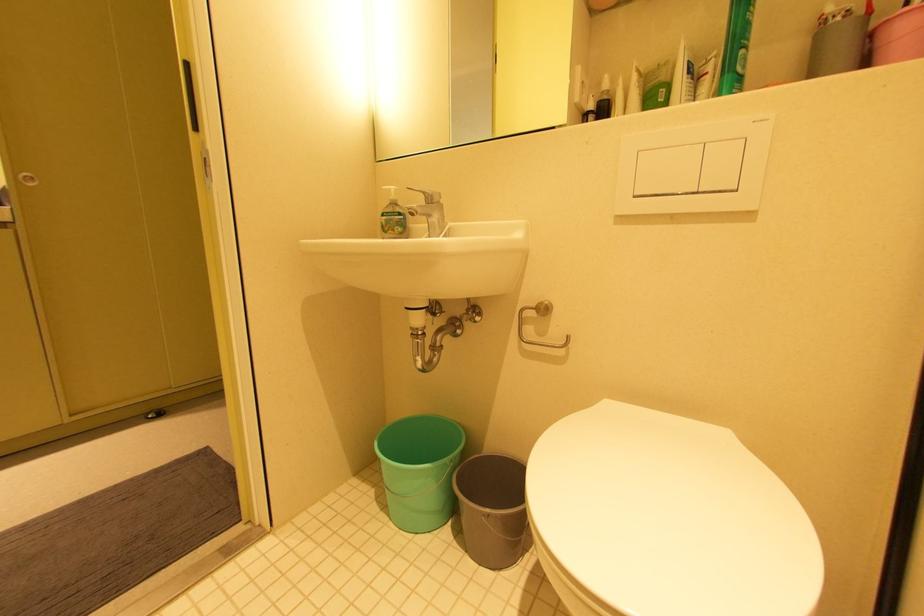
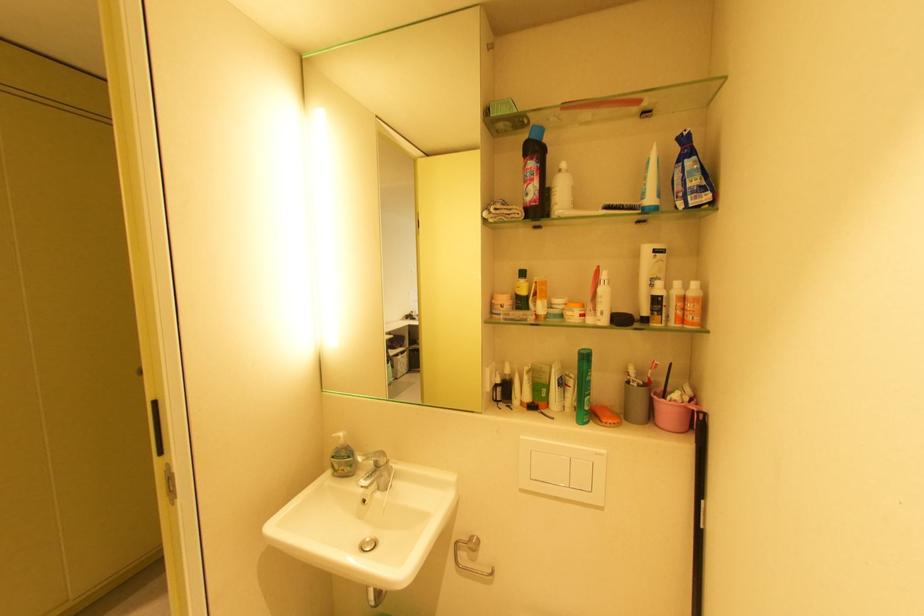
Locate, in the second image, the point that corresponds to point (433, 193) in the first image.

(382, 461)